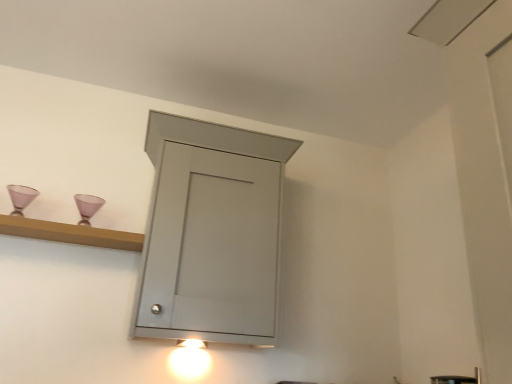
Question: Considering the relative sizes of matte white light fixture at lower center and wooden shelf at upper left in the image provided, is matte white light fixture at lower center thinner than wooden shelf at upper left?

Choices:
 (A) yes
 (B) no

Answer: (A)

Question: Is matte white light fixture at lower center oriented away from wooden shelf at upper left?

Choices:
 (A) no
 (B) yes

Answer: (A)

Question: Does matte white light fixture at lower center touch wooden shelf at upper left?

Choices:
 (A) yes
 (B) no

Answer: (B)

Question: Is matte white light fixture at lower center bigger than wooden shelf at upper left?

Choices:
 (A) yes
 (B) no

Answer: (B)

Question: Is matte white light fixture at lower center to the left of wooden shelf at upper left from the viewer's perspective?

Choices:
 (A) yes
 (B) no

Answer: (B)

Question: Does matte white light fixture at lower center appear on the right side of wooden shelf at upper left?

Choices:
 (A) yes
 (B) no

Answer: (A)

Question: Does matte gray cabinet at center have a lesser height compared to wooden shelf at upper left?

Choices:
 (A) no
 (B) yes

Answer: (A)

Question: Considering the relative sizes of matte gray cabinet at center and wooden shelf at upper left in the image provided, is matte gray cabinet at center wider than wooden shelf at upper left?

Choices:
 (A) no
 (B) yes

Answer: (B)

Question: Can you confirm if matte gray cabinet at center is positioned to the left of wooden shelf at upper left?

Choices:
 (A) no
 (B) yes

Answer: (A)

Question: Is matte gray cabinet at center outside of wooden shelf at upper left?

Choices:
 (A) yes
 (B) no

Answer: (A)

Question: From the image's perspective, does matte gray cabinet at center appear lower than wooden shelf at upper left?

Choices:
 (A) yes
 (B) no

Answer: (A)

Question: Is wooden shelf at upper left at the back of matte gray cabinet at center?

Choices:
 (A) yes
 (B) no

Answer: (B)

Question: Is satin nickel faucet at lower right in front of matte white light fixture at lower center?

Choices:
 (A) yes
 (B) no

Answer: (A)